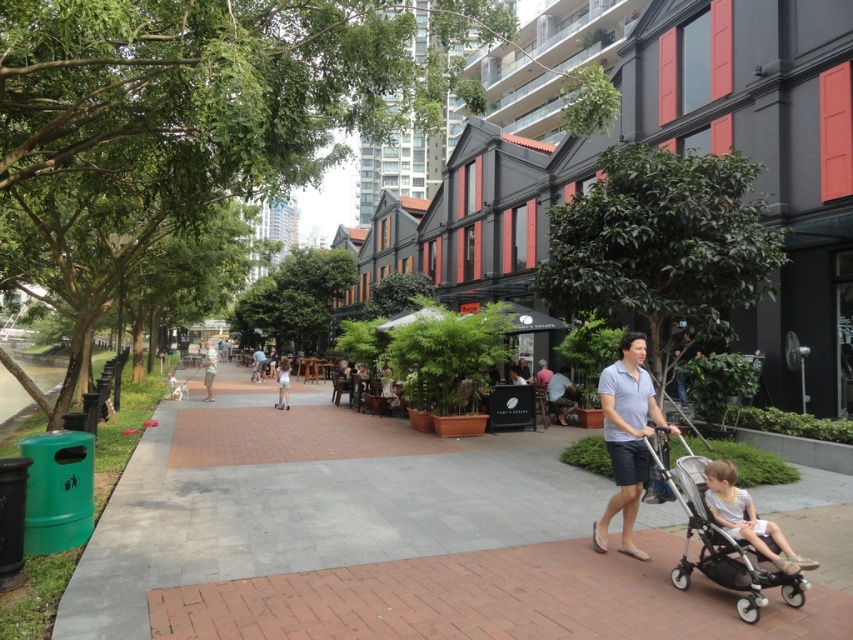
Question: Among these objects, which one is nearest to the camera?

Choices:
 (A) light brown wooden pole at center
 (B) gray cotton shirt at center-right

Answer: (B)

Question: Can you confirm if gray cotton shirt at center-right is positioned to the left of light yellow shirt at lower right?

Choices:
 (A) yes
 (B) no

Answer: (A)

Question: Does brick pavement at center have a larger size compared to light yellow shirt at lower right?

Choices:
 (A) no
 (B) yes

Answer: (B)

Question: Which point appears closest to the camera in this image?

Choices:
 (A) (560, 621)
 (B) (756, 525)
 (C) (288, 362)
 (D) (202, 378)

Answer: (A)

Question: Which of the following is the farthest from the observer?

Choices:
 (A) (660, 452)
 (B) (550, 380)

Answer: (B)

Question: Does brick pavement at center appear on the right side of silver metallic stroller at lower right?

Choices:
 (A) yes
 (B) no

Answer: (B)